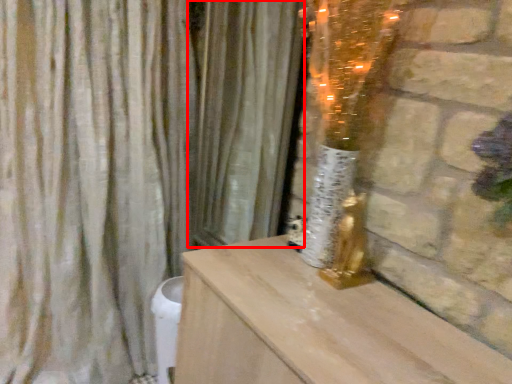
Question: From the image's perspective, where is curtain (annotated by the red box) located in relation to curtain in the image?

Choices:
 (A) below
 (B) above

Answer: (B)